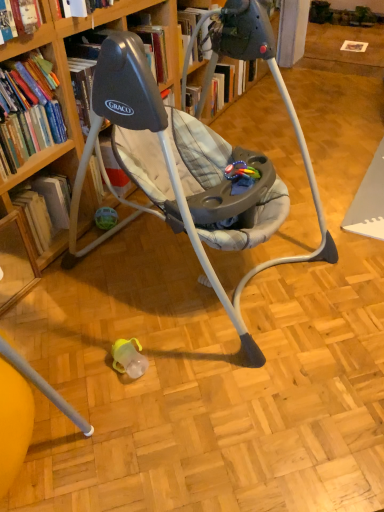
At what (x,y) coordinates should I click in order to perform the action: click on free space in front of wooden bookcase at upper left. Please return your answer as a coordinate pair (x, y). Looking at the image, I should click on [222, 404].